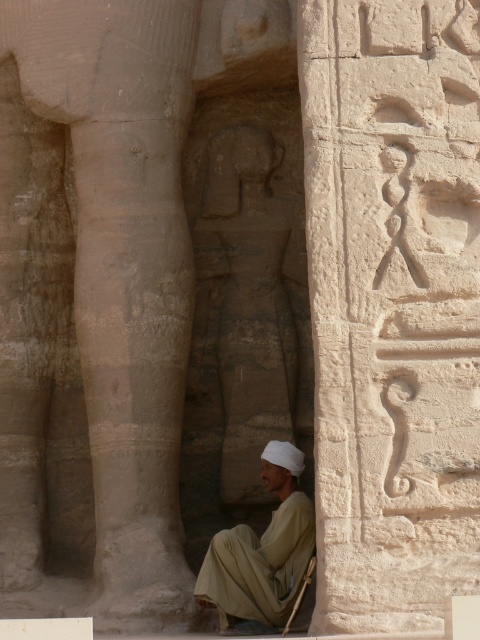
Can you confirm if smooth stone hieroglyphs at center is positioned to the right of beige cotton robe at lower center?

Yes, smooth stone hieroglyphs at center is to the right of beige cotton robe at lower center.

You are a GUI agent. You are given a task and a screenshot of the screen. Output one action in this format:
    pyautogui.click(x=<x>, y=<y>)
    Task: Click on the smooth stone hieroglyphs at center
    
    Given the screenshot: What is the action you would take?
    pyautogui.click(x=393, y=305)

Where is `smooth stone hieroglyphs at center`? The height and width of the screenshot is (640, 480). smooth stone hieroglyphs at center is located at coordinates (393, 305).

Is gray stone statue at center closer to camera compared to beige cotton robe at lower center?

No, gray stone statue at center is behind beige cotton robe at lower center.

Can you confirm if gray stone statue at center is positioned below beige cotton robe at lower center?

Incorrect, gray stone statue at center is not positioned below beige cotton robe at lower center.

The image size is (480, 640). What do you see at coordinates (240, 316) in the screenshot?
I see `gray stone statue at center` at bounding box center [240, 316].

I want to click on gray stone statue at center, so click(240, 316).

Can you confirm if smooth stone hieroglyphs at center is positioned below gray stone statue at center?

No, smooth stone hieroglyphs at center is not below gray stone statue at center.

Which is in front, point (478, 140) or point (249, 308)?

Point (478, 140) is in front.

Is point (457, 397) positioned in front of point (195, 248)?

Yes, it is in front of point (195, 248).

Where is `smooth stone hieroglyphs at center`? The image size is (480, 640). smooth stone hieroglyphs at center is located at coordinates (393, 305).